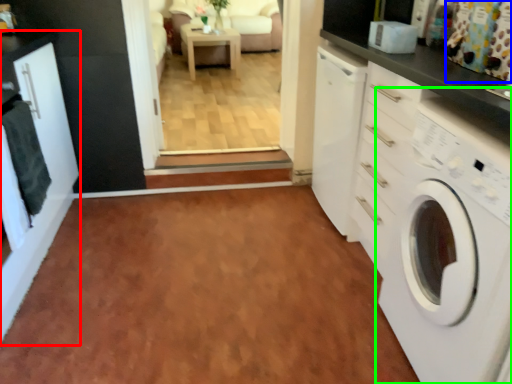
Question: Which object is positioned closest to cabinetry (highlighted by a red box)? Select from curtain (highlighted by a blue box) and washing machine (highlighted by a green box).

Choices:
 (A) curtain
 (B) washing machine

Answer: (B)